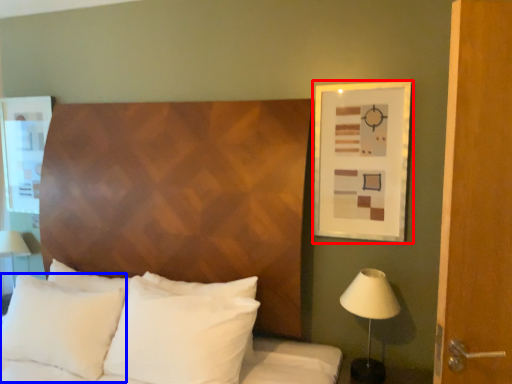
Question: Which of the following is the farthest to the observer, picture frame (highlighted by a red box) or pillow (highlighted by a blue box)?

Choices:
 (A) picture frame
 (B) pillow

Answer: (A)